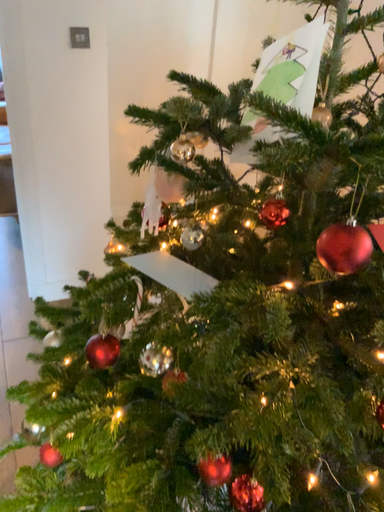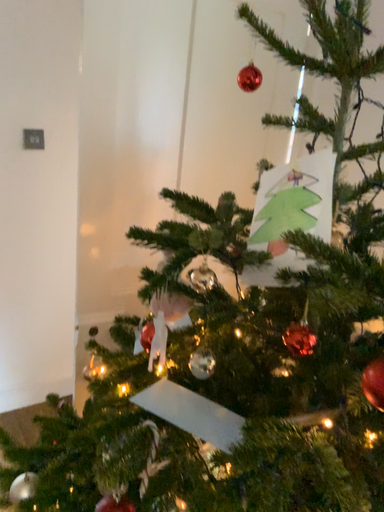
Question: Which way did the camera rotate in the video?

Choices:
 (A) rotated right
 (B) rotated left

Answer: (A)